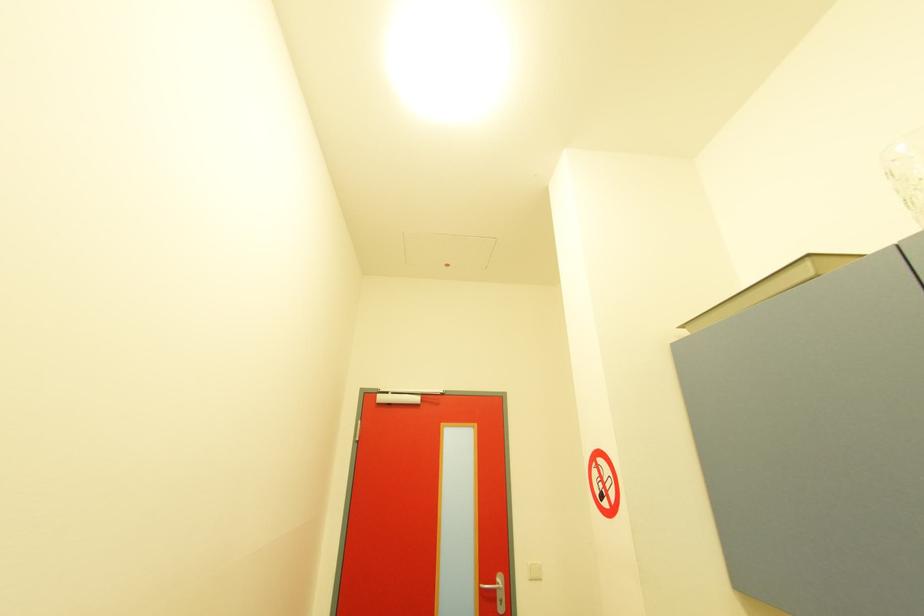
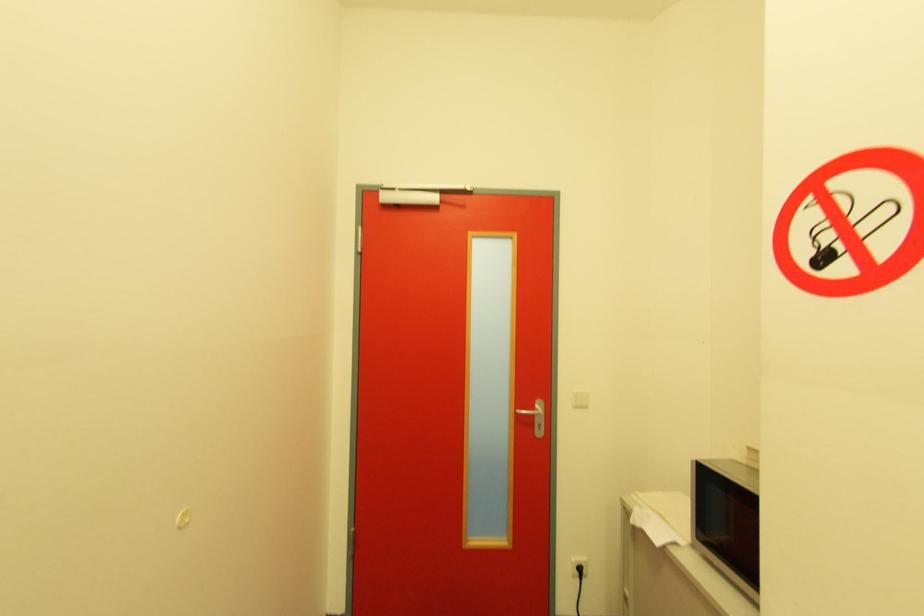
Question: Which direction would the cameraman need to move to produce the second image? Reply with the corresponding letter.

Choices:
 (A) Left
 (B) Right
 (C) Forward
 (D) Backward

Answer: (C)